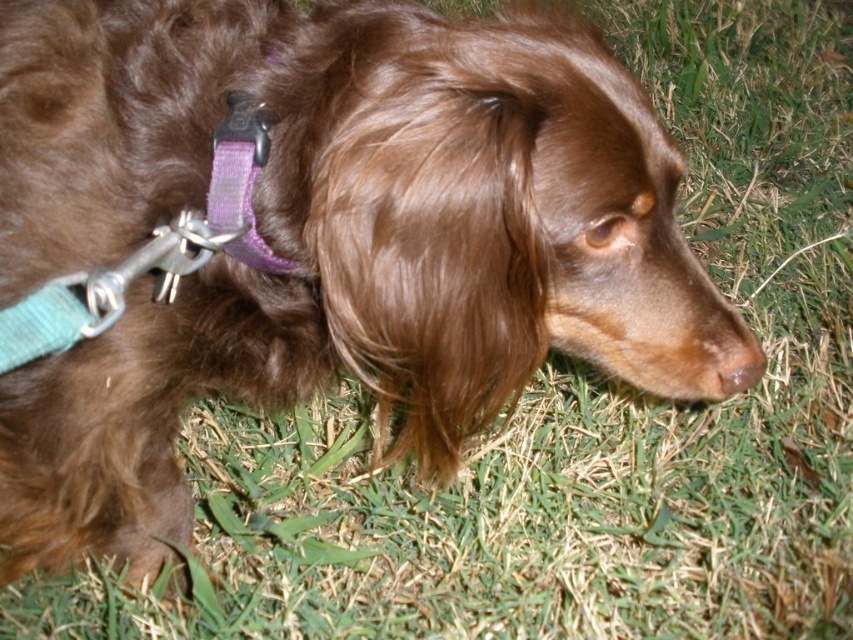
You are a photographer standing at the camera position. You want to attach a new leash to the purple fabric collar at upper left. The leash you have is 30 inches long. Will the leash be long enough to reach the collar from the camera?

The distance between the purple fabric collar at upper left and the camera is 32.75 inches. Since the leash is only 30 inches long, it will not be long enough to reach the collar from the camera.

You are a dog owner trying to decide whether to replace your dog collar. You have a new collar that is the same size as the brown matte nose at lower center. Will the new collar fit the dog if you want it to be as wide as the current purple fabric collar at upper left?

The purple fabric collar at upper left is wider than the brown matte nose at lower center. Since the new collar is the same size as the nose, it will not be as wide as the current purple collar. Therefore, the new collar will be narrower and may not fit as wide as desired.

You are taking a photo of the dog and want to focus on two specific points on its collar. The first point is at coordinates point (x=256, y=266) and the second is at point (x=746, y=388). Which point should you focus on first to ensure it appears clearer in the photo?

Point (x=256, y=266) is closer to the camera than point (x=746, y=388), so focusing on point (x=256, y=266) first will ensure it appears clearer in the photo.